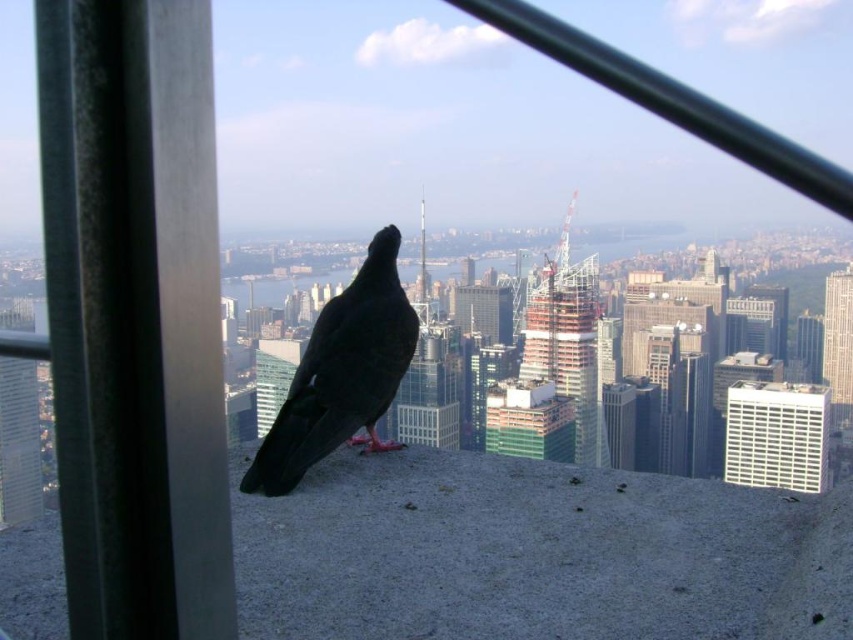
You are an urban planner analyzing the image of the city skyline. There is a point marked at coordinates (x=341, y=372). What object in the scene is located at this point?

The point at coordinates (x=341, y=372) corresponds to the black matte bird at center.

A photographer wants to capture the black matte bird at center in their shot. They know the bird is located at coordinates point 0.584, 0.402. If the photographer is positioned at point 0.0, 0.0, which direction should they move their camera to center the bird in the frame?

The photographer should move their camera to the right and upwards because the bird is located at point [341,372], which is to the right and above the photographer at point [0,0].

You are an architect designing a new building and want to ensure that the black matte bird at center and the white textured window at center right are visible from the street below. Given their sizes, which object will appear larger to someone looking up from the ground?

The black matte bird at center is taller than the white textured window at center right, so it will appear larger to someone looking up from the ground.